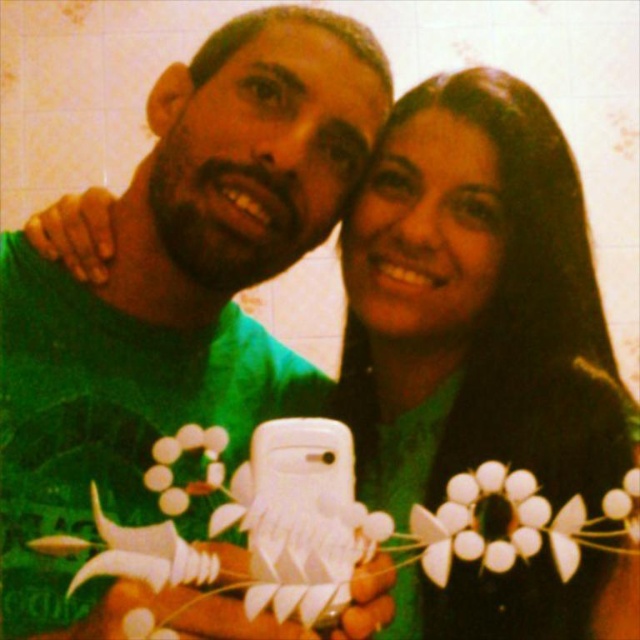
Question: Based on their relative distances, which object is nearer to the green matte necklace at center?

Choices:
 (A) green matte shirt at center
 (B) white paper flower at center

Answer: (B)

Question: Which of the following is the farthest from the observer?

Choices:
 (A) green matte shirt at center
 (B) green matte necklace at center
 (C) white paper flower at center

Answer: (B)

Question: Can you confirm if green matte necklace at center is positioned to the right of white paper flower at center?

Choices:
 (A) yes
 (B) no

Answer: (B)

Question: Which object is positioned closest to the green matte shirt at center?

Choices:
 (A) green matte necklace at center
 (B) white paper flower at center

Answer: (A)

Question: Is green matte shirt at center positioned in front of green matte necklace at center?

Choices:
 (A) yes
 (B) no

Answer: (A)

Question: Observing the image, what is the correct spatial positioning of green matte shirt at center in reference to green matte necklace at center?

Choices:
 (A) above
 (B) below

Answer: (A)